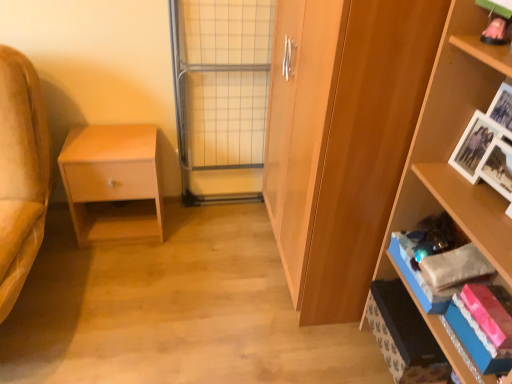
Question: Considering the positions of point (102, 208) and point (385, 357), is point (102, 208) closer or farther from the camera than point (385, 357)?

Choices:
 (A) farther
 (B) closer

Answer: (A)

Question: Is matte wood nightstand at left wider or thinner than blue cardboard box at lower right?

Choices:
 (A) thin
 (B) wide

Answer: (B)

Question: Estimate the real-world distances between objects in this image. Which object is farther from the wooden cabinet at center?

Choices:
 (A) metal grid screen door at center
 (B) blue cardboard box at lower right
 (C) shiny pink book at lower right
 (D) matte wood nightstand at left
 (E) wooden shelf at right

Answer: (D)

Question: Which of these objects is positioned farthest from the shiny pink book at lower right?

Choices:
 (A) wooden cabinet at center
 (B) wooden shelf at right
 (C) metal grid screen door at center
 (D) matte wood nightstand at left
 (E) blue cardboard box at lower right

Answer: (D)